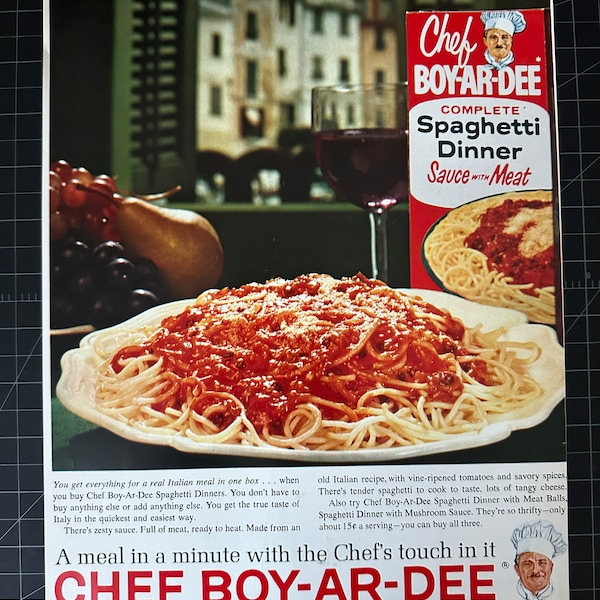
In order to click on plate in this screenshot , I will do `click(439, 270)`, `click(504, 433)`.